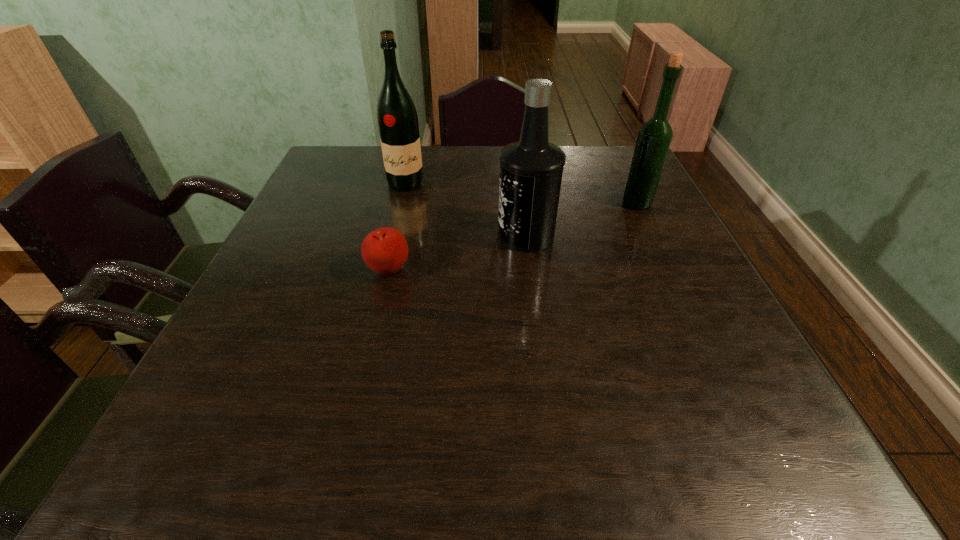
Identify the location of vacant space located 0.350m on the front label of the third farthest object. (349, 235).

Find the location of a particular element. The width and height of the screenshot is (960, 540). free space located on the front label of the third farthest object is located at coordinates coord(468,235).

I want to click on vacant area located 0.350m on the front label of the third farthest object, so click(x=349, y=235).

Find the location of a particular element. Image resolution: width=960 pixels, height=540 pixels. free space located on the right of the nearest object is located at coordinates (591, 271).

At what (x,y) coordinates should I click in order to perform the action: click on object present at the far edge. Please return your answer as a coordinate pair (x, y). Image resolution: width=960 pixels, height=540 pixels. Looking at the image, I should click on (397, 118).

Where is `object that is at the right edge`? Image resolution: width=960 pixels, height=540 pixels. object that is at the right edge is located at coordinates (654, 137).

Locate an element on the screen. This screenshot has height=540, width=960. free space at the far edge of the desktop is located at coordinates (448, 171).

This screenshot has width=960, height=540. What are the coordinates of `free space at the near edge of the desktop` in the screenshot? It's located at (335, 430).

Find the location of a particular element. The height and width of the screenshot is (540, 960). vacant space at the left edge is located at coordinates (239, 396).

Where is `vacant space at the right edge of the desktop`? The width and height of the screenshot is (960, 540). vacant space at the right edge of the desktop is located at coordinates (693, 363).